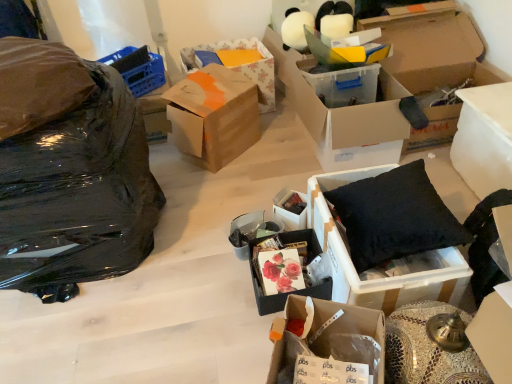
At what (x,y) coordinates should I click in order to perform the action: click on vacant area that lies between black plastic bag at left and matte floral print box at center, the third box in the left-to-right sequence. Please return your answer as a coordinate pair (x, y). Image resolution: width=512 pixels, height=384 pixels. Looking at the image, I should click on (178, 259).